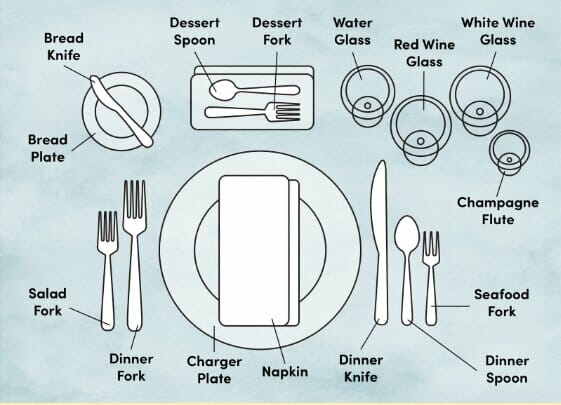
Find the location of a particular element. The width and height of the screenshot is (561, 405). plate is located at coordinates (309, 261).